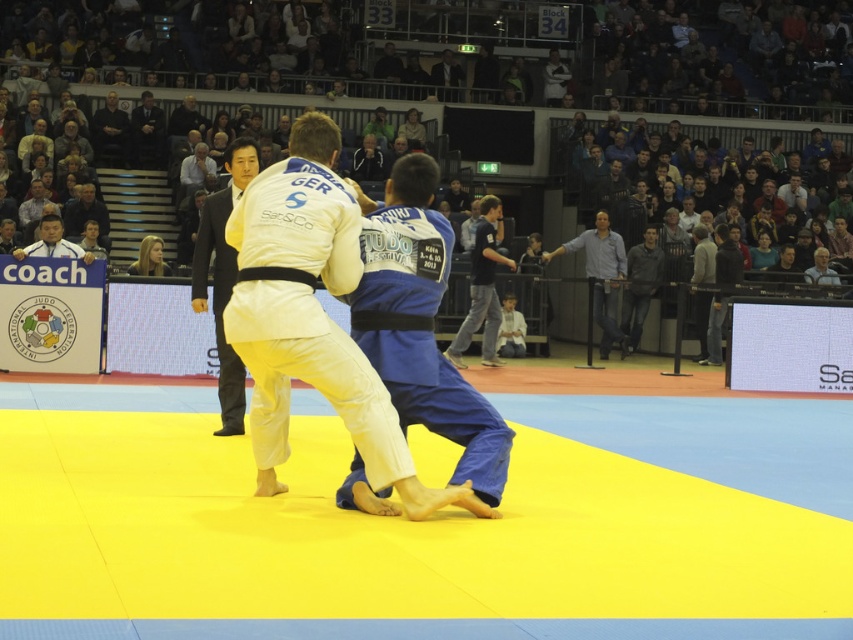
Does white fabric judo at center have a smaller size compared to matte black shirt at upper left?

Actually, white fabric judo at center might be larger than matte black shirt at upper left.

Where is `white fabric judo at center`? The height and width of the screenshot is (640, 853). white fabric judo at center is located at coordinates (312, 317).

Locate an element on the screen. white fabric judo at center is located at coordinates (312, 317).

Can you confirm if white fabric judo at center is positioned to the right of dark blue jeans at center?

No, white fabric judo at center is not to the right of dark blue jeans at center.

Is white fabric judo at center further to camera compared to dark blue jeans at center?

No, white fabric judo at center is closer to the viewer.

Which is in front, point (306, 211) or point (488, 285)?

Point (306, 211)

Where is `white fabric judo at center`? This screenshot has width=853, height=640. white fabric judo at center is located at coordinates (312, 317).

Between white fabric judo at center and dark gray suit at upper center, which one has more height?

With more height is white fabric judo at center.

Is white fabric judo at center to the left of dark gray suit at upper center from the viewer's perspective?

Incorrect, white fabric judo at center is not on the left side of dark gray suit at upper center.

Who is more forward, (303, 195) or (125, 144)?

Positioned in front is point (303, 195).

Image resolution: width=853 pixels, height=640 pixels. I want to click on white fabric judo at center, so click(x=312, y=317).